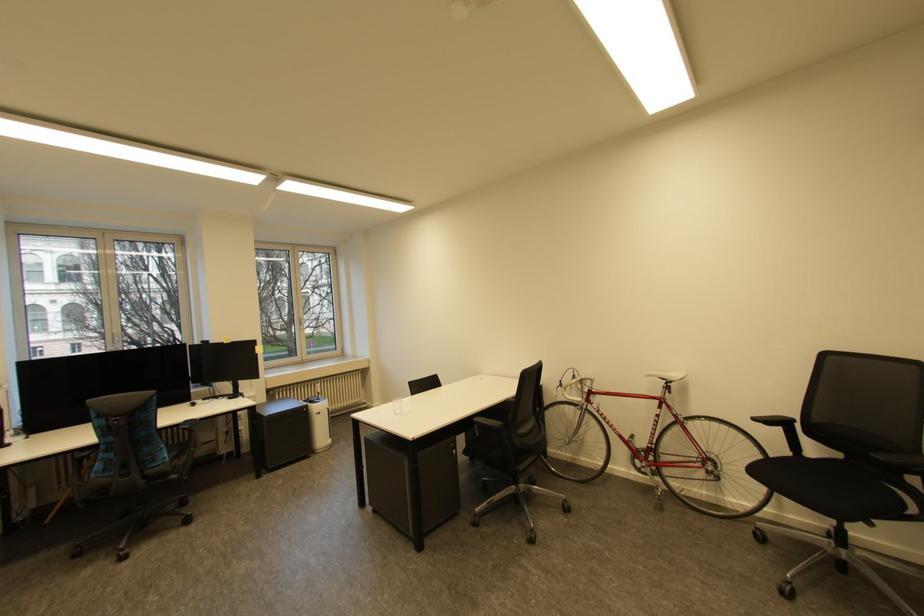
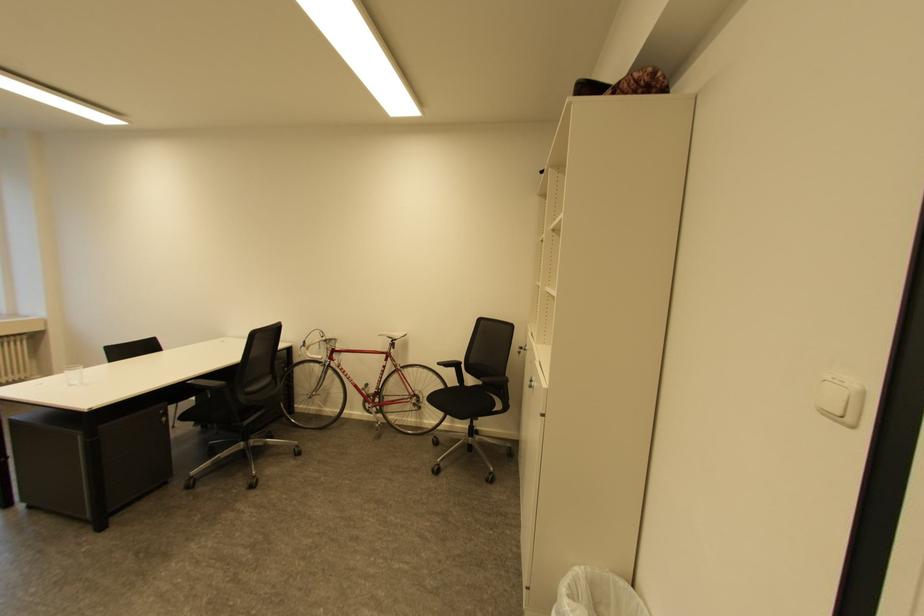
Question: The first image is from the beginning of the video and the second image is from the end. How did the camera likely rotate when shooting the video?

Choices:
 (A) Left
 (B) Right
 (C) Up
 (D) Down

Answer: (B)